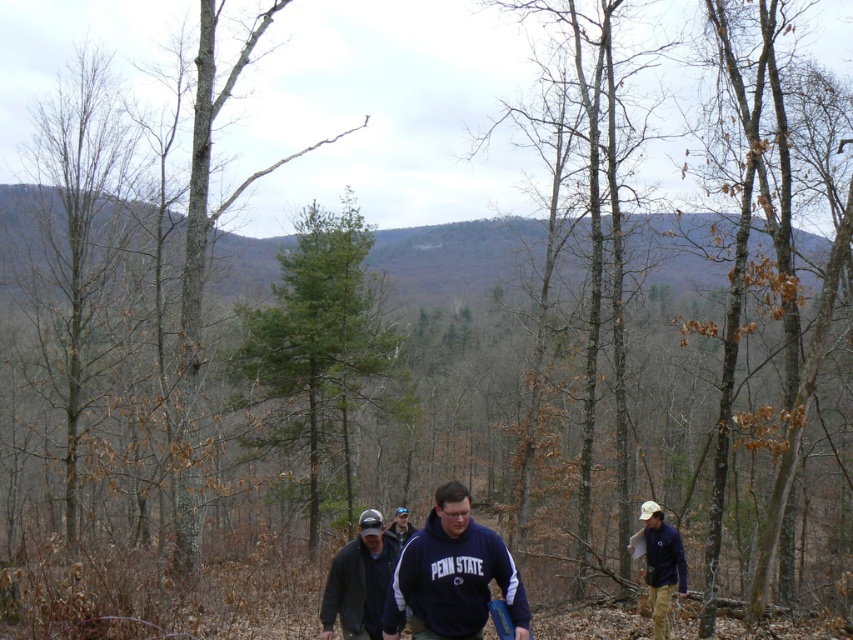
You are a hiker trying to locate your friend who is wearing a dark blue cotton shirt at center. You see a blue fabric jacket at lower right. Based on the scene, is the jacket above or below your friend?

The blue fabric jacket at lower right is located above the dark blue cotton shirt at center, so the jacket is above your friend.

You are a hiker navigating through the forest and see two points marked on your map. The first point is at coordinates point (659, 548) and the second is at point (412, 532). Which point is closer to you if you are standing at the starting point of the trail?

Point (659, 548) is in front of point (412, 532), so it is closer to your current position at the starting point of the trail.